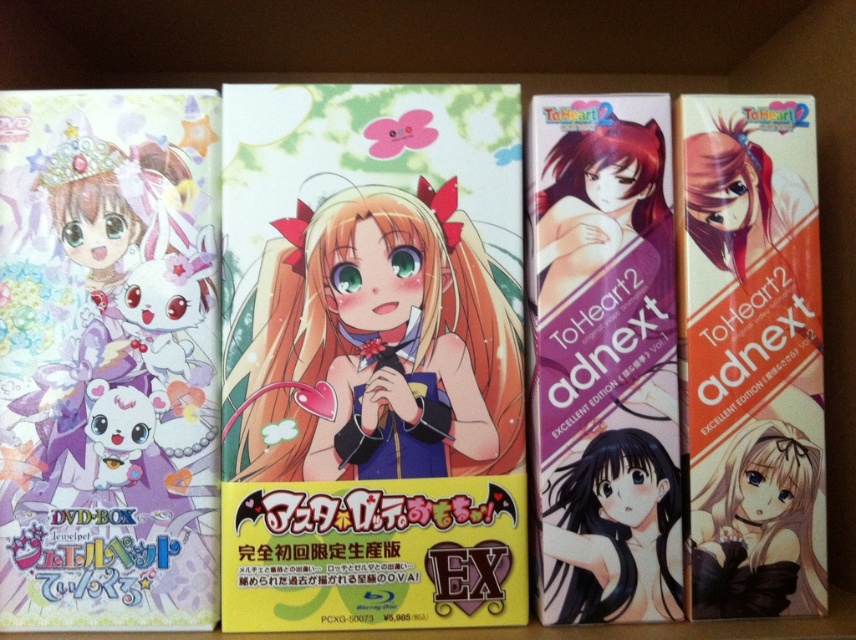
Question: Is smooth brown hair at center bigger than matte purple card at center?

Choices:
 (A) no
 (B) yes

Answer: (A)

Question: Can you confirm if purple glossy book at center is bigger than black glossy hair at center?

Choices:
 (A) no
 (B) yes

Answer: (B)

Question: Considering the real-world distances, which object is closest to the orange matte book at right?

Choices:
 (A) black glossy hair at center
 (B) smooth brown hair at center

Answer: (B)

Question: Which point is closer to the camera taking this photo?

Choices:
 (A) (562, 522)
 (B) (717, 484)
 (C) (586, 429)

Answer: (A)

Question: Is purple glossy book at center above black glossy hair at center?

Choices:
 (A) no
 (B) yes

Answer: (B)

Question: Which point is closer to the camera?

Choices:
 (A) (727, 493)
 (B) (33, 532)
 (C) (734, 467)
 (D) (581, 611)

Answer: (D)